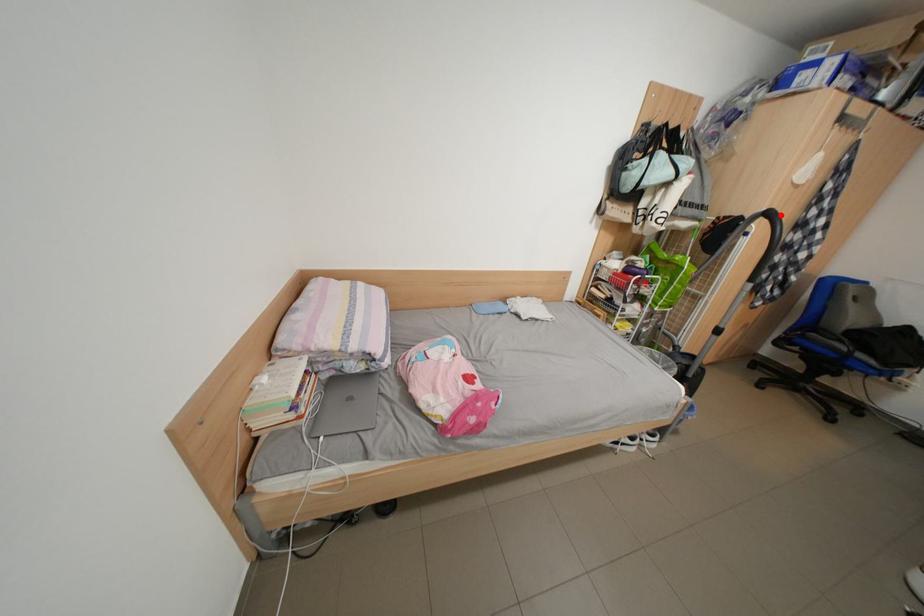
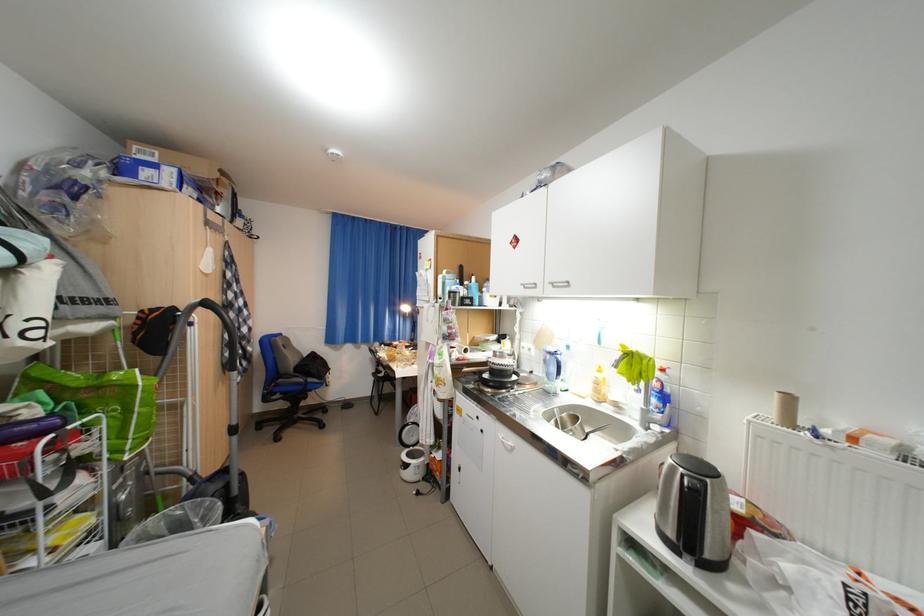
Locate, in the second image, the point that corresponds to the highlighted location in the first image.

(217, 305)